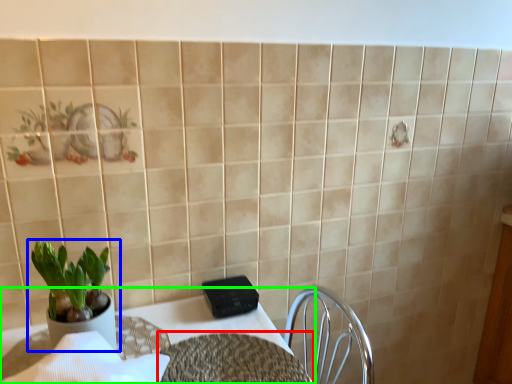
Question: Based on their relative distances, which object is nearer to round table (highlighted by a red box)? Choose from houseplant (highlighted by a blue box) and table (highlighted by a green box).

Choices:
 (A) houseplant
 (B) table

Answer: (B)